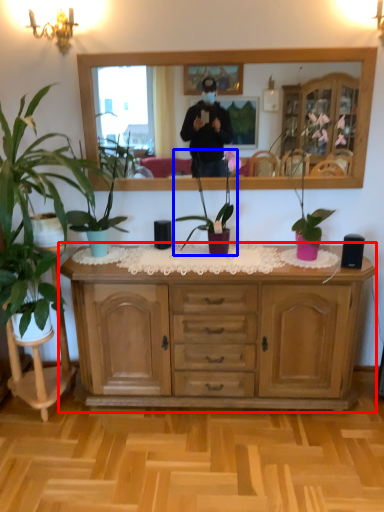
Question: Which object appears farthest to the camera in this image, cabinetry (highlighted by a red box) or houseplant (highlighted by a blue box)?

Choices:
 (A) cabinetry
 (B) houseplant

Answer: (B)